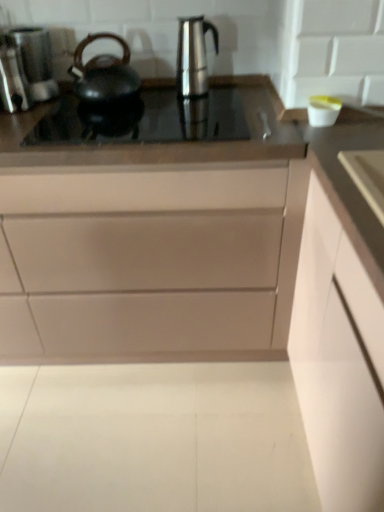
Question: Does stainless steel coffee pot at center turn towards satin nickel faucet at center?

Choices:
 (A) no
 (B) yes

Answer: (A)

Question: Is stainless steel coffee pot at center shorter than satin nickel faucet at center?

Choices:
 (A) no
 (B) yes

Answer: (A)

Question: Does stainless steel coffee pot at center have a greater width compared to satin nickel faucet at center?

Choices:
 (A) yes
 (B) no

Answer: (B)

Question: Is stainless steel coffee pot at center touching satin nickel faucet at center?

Choices:
 (A) no
 (B) yes

Answer: (A)

Question: From a real-world perspective, is stainless steel coffee pot at center below satin nickel faucet at center?

Choices:
 (A) no
 (B) yes

Answer: (A)

Question: From a real-world perspective, relative to matte white drawer at center, which is counted as the 1th cabinetry, starting from the left, is black glass cooktop at center vertically above or below?

Choices:
 (A) below
 (B) above

Answer: (B)

Question: In the image, is black glass cooktop at center positioned in front of or behind matte white drawer at center, which is counted as the 1th cabinetry, starting from the left?

Choices:
 (A) front
 (B) behind

Answer: (B)

Question: In terms of size, does black glass cooktop at center appear bigger or smaller than matte white drawer at center, which is counted as the 1th cabinetry, starting from the left?

Choices:
 (A) small
 (B) big

Answer: (A)

Question: Looking at their shapes, would you say black glass cooktop at center is wider or thinner than matte white drawer at center, arranged as the 2th cabinetry when viewed from the right?

Choices:
 (A) wide
 (B) thin

Answer: (B)

Question: From a real-world perspective, is black matte kettle at left physically located above or below white matte cabinet at right, which ranks as the second cabinetry in left-to-right order?

Choices:
 (A) below
 (B) above

Answer: (B)

Question: Which is correct: black matte kettle at left is inside white matte cabinet at right, which is counted as the 1th cabinetry, starting from the right, or outside of it?

Choices:
 (A) outside
 (B) inside

Answer: (A)

Question: Visually, is black matte kettle at left positioned to the left or to the right of white matte cabinet at right, which is counted as the 1th cabinetry, starting from the right?

Choices:
 (A) right
 (B) left

Answer: (B)

Question: Does point (74, 60) appear closer or farther from the camera than point (339, 260)?

Choices:
 (A) farther
 (B) closer

Answer: (A)

Question: From the image's perspective, is satin nickel faucet at center positioned above or below matte white drawer at center, arranged as the 2th cabinetry when viewed from the right?

Choices:
 (A) above
 (B) below

Answer: (A)

Question: Considering the positions of satin nickel faucet at center and matte white drawer at center, which is counted as the 1th cabinetry, starting from the left, in the image, is satin nickel faucet at center taller or shorter than matte white drawer at center, which is counted as the 1th cabinetry, starting from the left,?

Choices:
 (A) tall
 (B) short

Answer: (B)